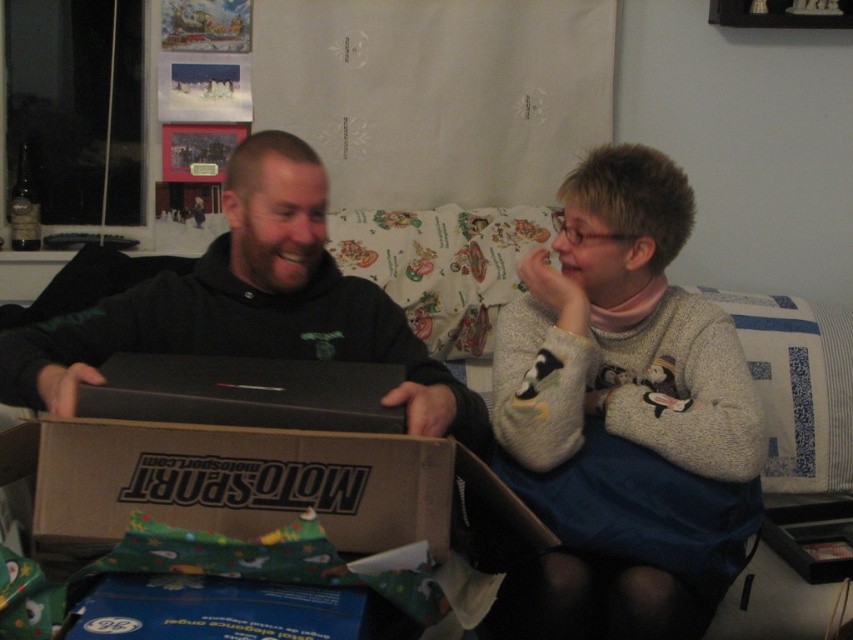
Can you confirm if light gray sweater at center is positioned above black matte laptop at center?

Actually, light gray sweater at center is below black matte laptop at center.

From the picture: Does light gray sweater at center have a greater width compared to black matte laptop at center?

No.

Is point (657, 516) farther from camera compared to point (248, 184)?

That is False.

You are a GUI agent. You are given a task and a screenshot of the screen. Output one action in this format:
    pyautogui.click(x=<x>, y=<y>)
    Task: Click on the light gray sweater at center
    The height and width of the screenshot is (640, 853).
    Given the screenshot: What is the action you would take?
    pyautogui.click(x=625, y=413)

What do you see at coordinates (625, 420) in the screenshot?
I see `matte black laptop at center` at bounding box center [625, 420].

Between matte black laptop at center and light gray sweater at center, which one is positioned higher?

matte black laptop at center is above.

Who is more forward, (653, 397) or (593, 220)?

Positioned in front is point (653, 397).

Identify the location of matte black laptop at center. The width and height of the screenshot is (853, 640). (625, 420).

Consider the image. Does matte black laptop at center have a lesser width compared to black matte laptop at center?

Incorrect, matte black laptop at center's width is not less than black matte laptop at center's.

Is matte black laptop at center behind black matte laptop at center?

Yes, matte black laptop at center is behind black matte laptop at center.

Between point (654, 577) and point (258, 305), which one is positioned behind?

The point (258, 305) is more distant.

This screenshot has width=853, height=640. Find the location of `matte black laptop at center`. matte black laptop at center is located at coordinates (625, 420).